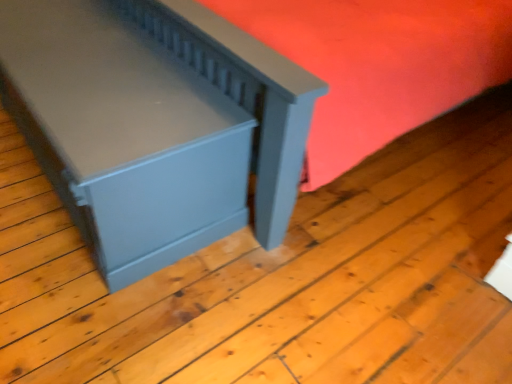
Identify the location of matte gray cabinet at lower left. The height and width of the screenshot is (384, 512). (155, 123).

The height and width of the screenshot is (384, 512). What do you see at coordinates (155, 123) in the screenshot?
I see `matte gray cabinet at lower left` at bounding box center [155, 123].

This screenshot has height=384, width=512. What are the coordinates of `matte gray cabinet at lower left` in the screenshot? It's located at (155, 123).